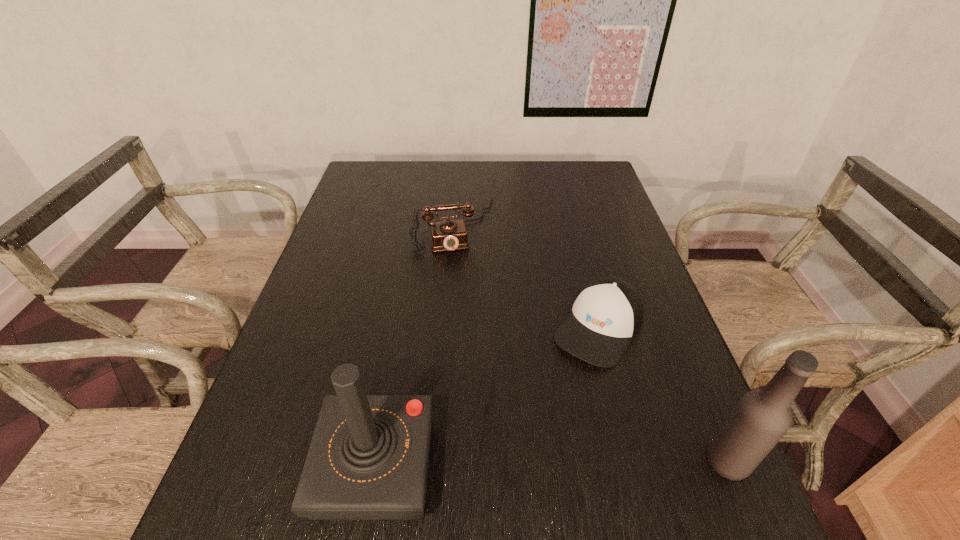
The image size is (960, 540). Find the location of `vacant space on the desktop that is between the joystick and the beer bottle and is positioned on the front panel of the cap`. vacant space on the desktop that is between the joystick and the beer bottle and is positioned on the front panel of the cap is located at coordinates (504, 464).

Where is `vacant space on the desktop that is between the joystick and the beer bottle and is positioned on the dial of the farthest object`? vacant space on the desktop that is between the joystick and the beer bottle and is positioned on the dial of the farthest object is located at coordinates (505, 464).